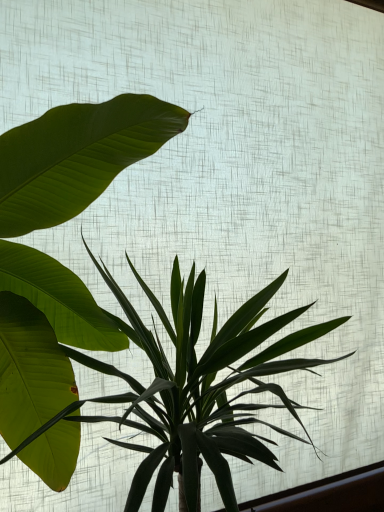
Image resolution: width=384 pixels, height=512 pixels. Describe the element at coordinates (194, 389) in the screenshot. I see `green glossy leaf at upper left` at that location.

Where is `green glossy leaf at upper left`? green glossy leaf at upper left is located at coordinates (194, 389).

I want to click on green glossy leaf at upper left, so click(x=194, y=389).